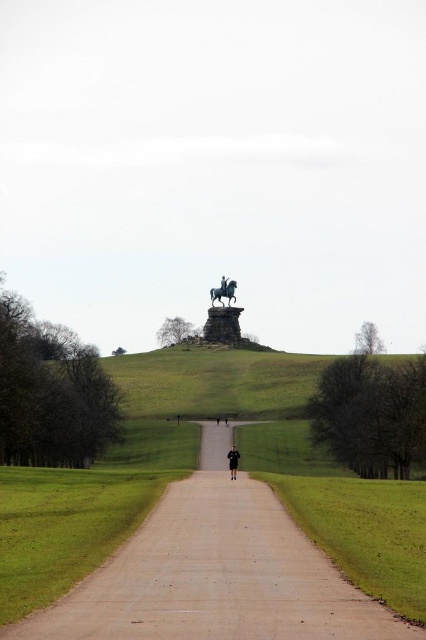
Question: Can you confirm if polished bronze horse at upper center is thinner than black leather jacket at center?

Choices:
 (A) yes
 (B) no

Answer: (B)

Question: Does polished bronze horse at upper center have a smaller size compared to black polished statue at upper center?

Choices:
 (A) no
 (B) yes

Answer: (A)

Question: Is black fabric person at center smaller than black leather jacket at center?

Choices:
 (A) yes
 (B) no

Answer: (A)

Question: Which is nearer to the black polished statue at upper center?

Choices:
 (A) black leather jacket at center
 (B) black fabric person at center
 (C) dark blue uniform at center

Answer: (A)

Question: Which point is closer to the camera?

Choices:
 (A) dark blue uniform at center
 (B) black polished statue at upper center
 (C) smooth concrete path at center

Answer: (C)

Question: Which point is closer to the camera?

Choices:
 (A) (221, 280)
 (B) (226, 280)
 (C) (388, 516)

Answer: (C)